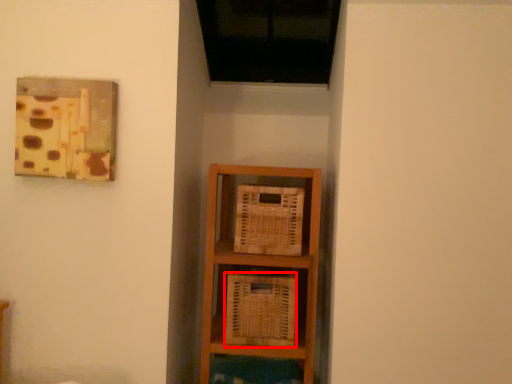
Question: Where is basket (annotated by the red box) located in relation to basket in the image?

Choices:
 (A) right
 (B) left

Answer: (B)